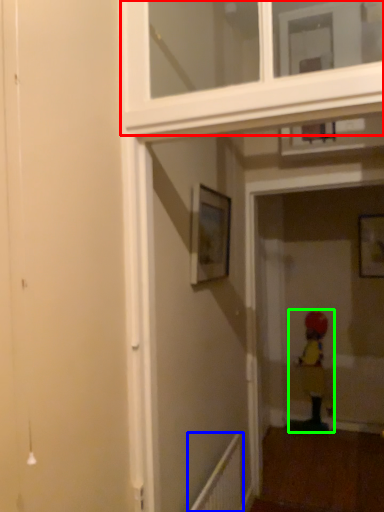
Question: Which object is the closest to the window frame (highlighted by a red box)? Choose among these: radiator (highlighted by a blue box) or child (highlighted by a green box).

Choices:
 (A) radiator
 (B) child

Answer: (A)